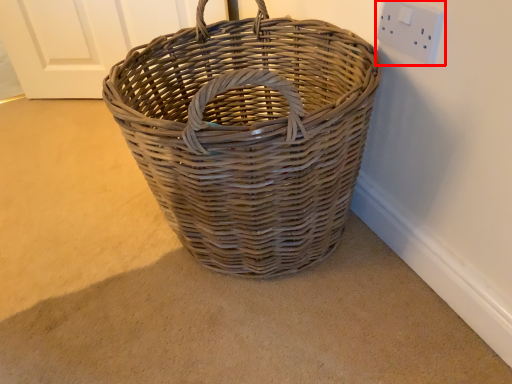
Question: Where is electric outlet (annotated by the red box) located in relation to picnic basket in the image?

Choices:
 (A) left
 (B) right

Answer: (B)